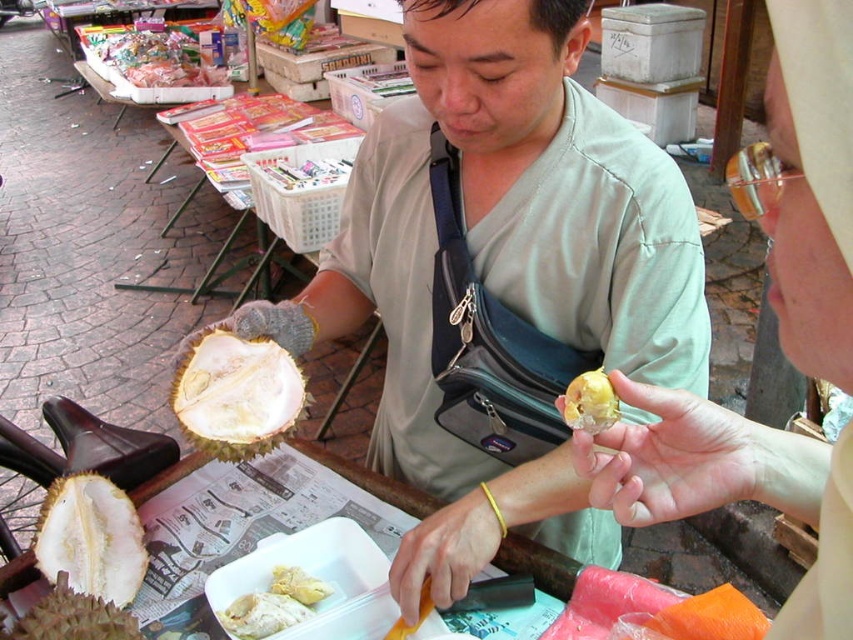
You are a customer at the durian vendor stand. You see two points marked on the ground in front of you. The first point is at coordinate point (x=294, y=417) and the second point is at coordinate point (x=97, y=600). Which point is closer to the vendor?

Point (x=97, y=600) is closer to the vendor because it is in front of point (x=294, y=417), which is behind it.